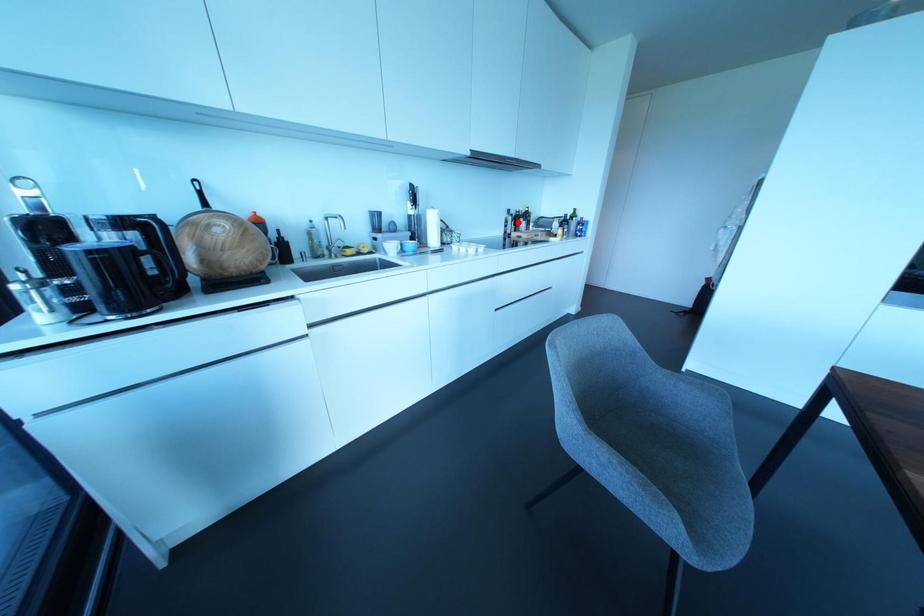
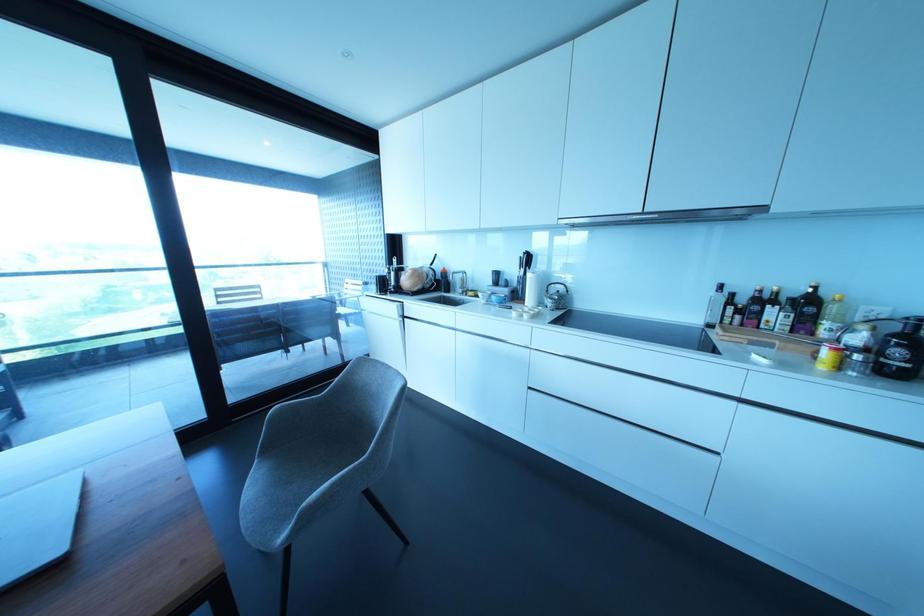
Question: A red point is marked in image1. In image2, is the corresponding 3D point closer to the camera or farther? Reply with the corresponding letter.

Choices:
 (A) The corresponding 3D point is closer.
 (B) The corresponding 3D point is farther.

Answer: (B)